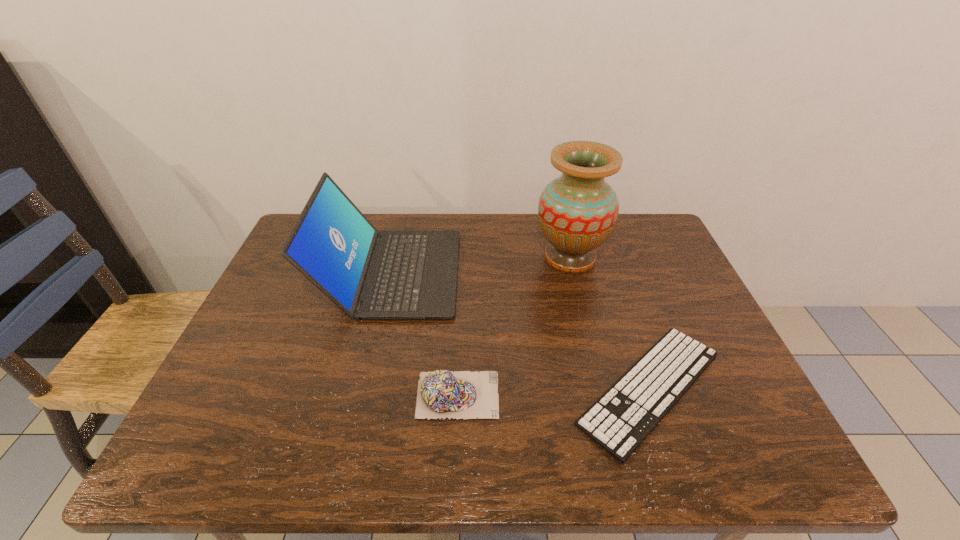
At what (x,y) coordinates should I click in order to perform the action: click on free space between the second shortest object and the third shortest object. Please return your answer as a coordinate pair (x, y). Looking at the image, I should click on click(424, 334).

The height and width of the screenshot is (540, 960). In order to click on free space between the vase and the laptop computer in this screenshot , I will do `click(480, 265)`.

This screenshot has height=540, width=960. Identify the location of vacant space that's between the laptop computer and the tallest object. (480, 265).

Locate an element on the screen. This screenshot has height=540, width=960. free space that is in between the cap and the vase is located at coordinates (514, 326).

Identify the location of free space between the tallest object and the third shortest object. The width and height of the screenshot is (960, 540). (480, 265).

Where is `free space between the second tallest object and the vase`? This screenshot has height=540, width=960. free space between the second tallest object and the vase is located at coordinates (480, 265).

The image size is (960, 540). What are the coordinates of `vacant region between the cap and the shortest object` in the screenshot? It's located at (554, 392).

The width and height of the screenshot is (960, 540). I want to click on empty space between the laptop computer and the tallest object, so click(480, 265).

The height and width of the screenshot is (540, 960). Identify the location of free spot between the tallest object and the computer keyboard. (610, 323).

Where is `blank region between the laptop computer and the third tallest object`? Image resolution: width=960 pixels, height=540 pixels. blank region between the laptop computer and the third tallest object is located at coordinates (424, 334).